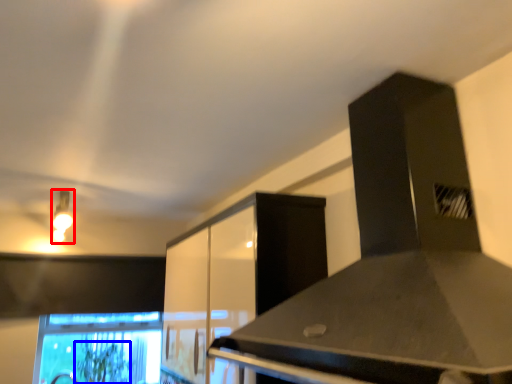
Question: Which point is closer to the camera, light fixture (highlighted by a red box) or plant (highlighted by a blue box)?

Choices:
 (A) light fixture
 (B) plant

Answer: (A)